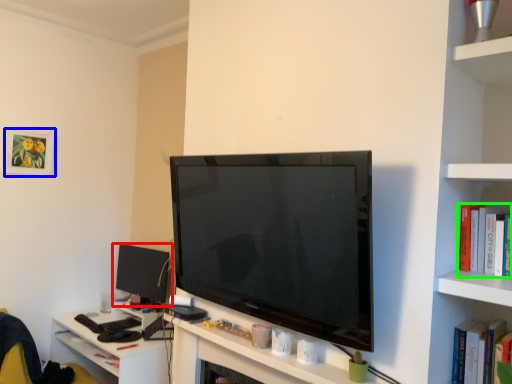
Question: Based on their relative distances, which object is farther from computer monitor (highlighted by a red box)? Choose from picture frame (highlighted by a blue box) and book (highlighted by a green box).

Choices:
 (A) picture frame
 (B) book

Answer: (B)